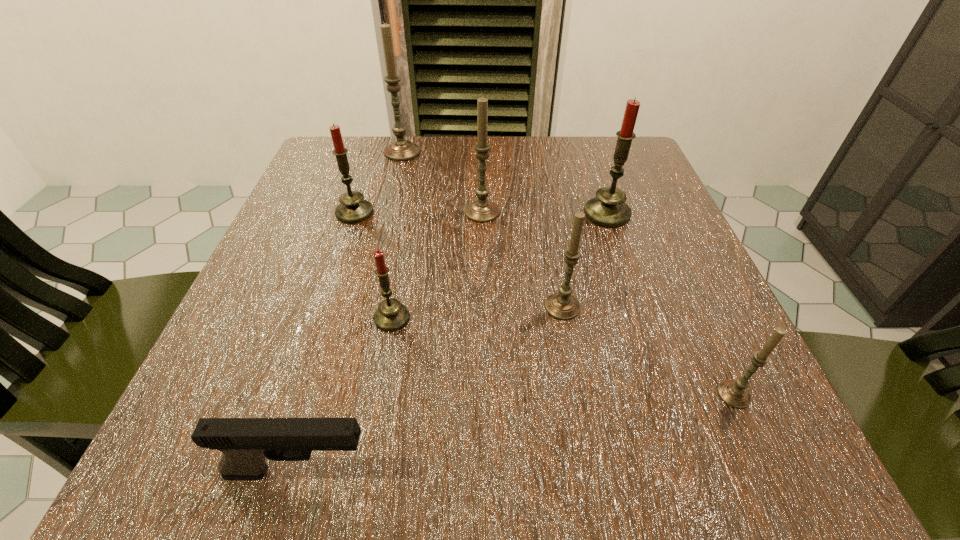
Locate an element on the screen. The width and height of the screenshot is (960, 540). the smallest red candle is located at coordinates (391, 315).

The width and height of the screenshot is (960, 540). Find the location of `the smallest gray candle`. the smallest gray candle is located at coordinates (734, 393).

Identify the location of the rightmost object. (734, 393).

At what (x,y) coordinates should I click in order to perform the action: click on pistol. Please return your answer as a coordinate pair (x, y). Looking at the image, I should click on (246, 443).

At what (x,y) coordinates should I click in order to perform the action: click on the shortest object. Please return your answer as a coordinate pair (x, y). Image resolution: width=960 pixels, height=540 pixels. Looking at the image, I should click on (246, 443).

Where is `vacant area located on the left of the farthest candle`? The image size is (960, 540). vacant area located on the left of the farthest candle is located at coordinates (353, 152).

This screenshot has width=960, height=540. In order to click on free space located on the left of the second object from right to left in this screenshot , I will do `click(558, 214)`.

At what (x,y) coordinates should I click in order to perform the action: click on free space located 0.050m on the back of the fourth candle from right to left. Please return your answer as a coordinate pair (x, y). This screenshot has height=540, width=960. Looking at the image, I should click on (482, 187).

Identify the location of vacant space located 0.250m on the right of the second smallest red candle. (504, 212).

Where is `vacant position located on the back of the sixth object from left to right`? vacant position located on the back of the sixth object from left to right is located at coordinates (542, 192).